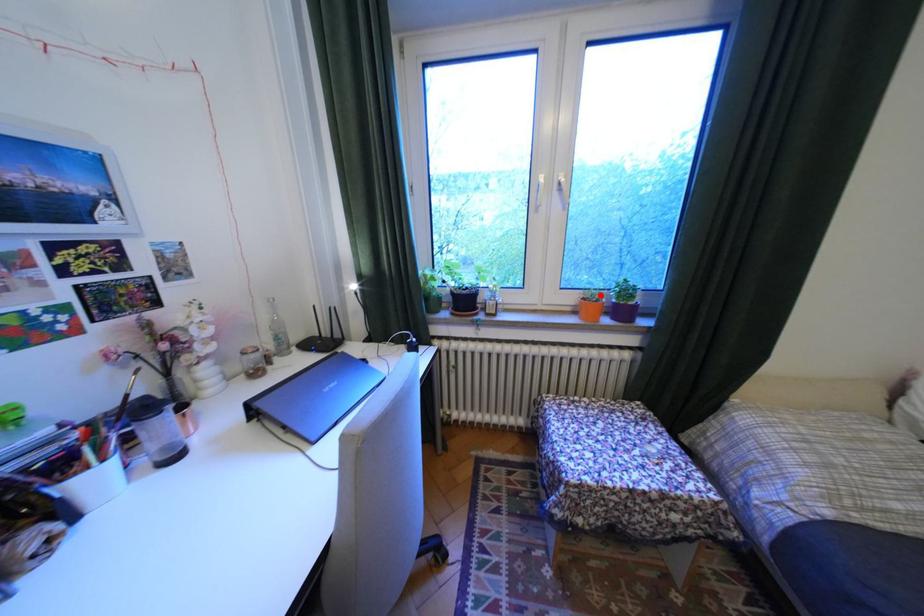
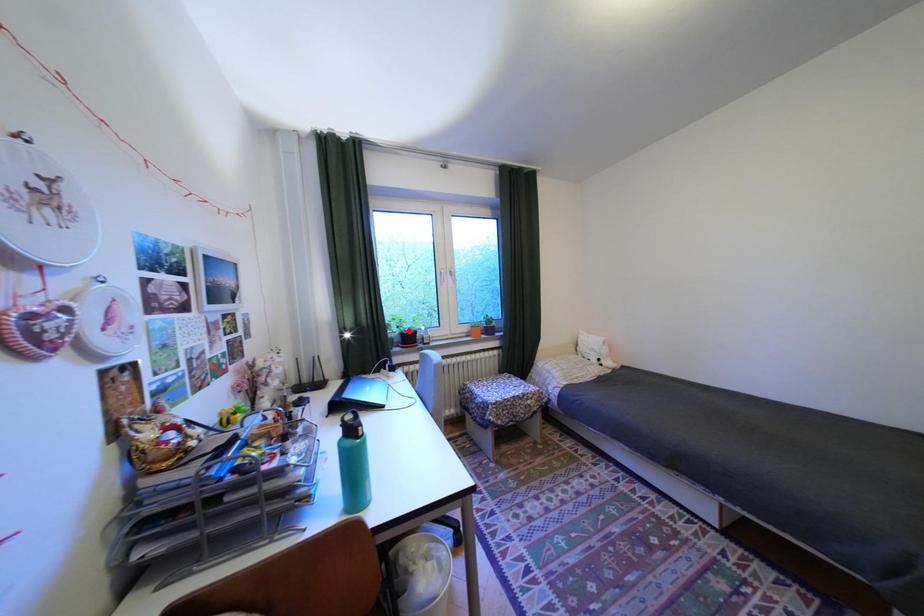
I am providing you with two images of the same scene from different viewpoints. A red point is marked on the first image and another point is marked on the second image. Is the marked point in image1 the same physical position as the marked point in image2?

No